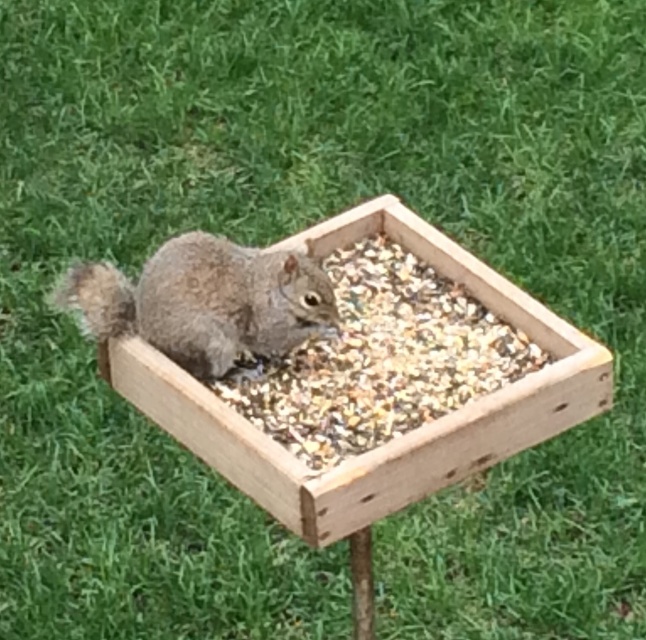
Is point (441, 289) behind point (218, 246)?

That is True.

Can you confirm if brown textured wood at center is wider than gray furry squirrel at center?

Yes, brown textured wood at center is wider than gray furry squirrel at center.

Who is more forward, (475, 385) or (187, 246)?

Point (475, 385) is in front.

Locate an element on the screen. The width and height of the screenshot is (646, 640). brown textured wood at center is located at coordinates (379, 358).